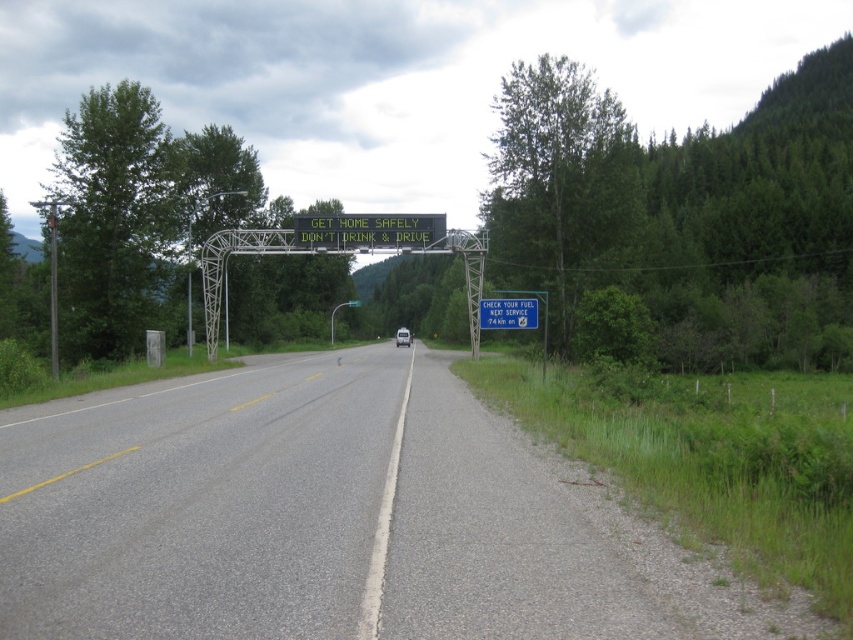
You are driving a white matte van at center and need to check the fuel level as indicated by the sign. Where should you look to see the gray asphalt road at center from your current position?

The gray asphalt road at center is located below the white matte van at center, so you can look downward from the van to see the road.